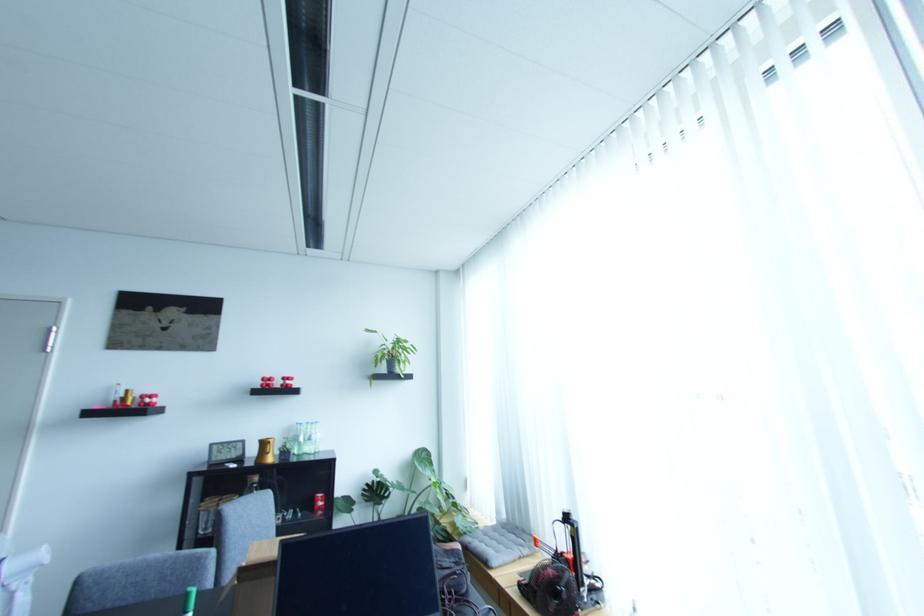
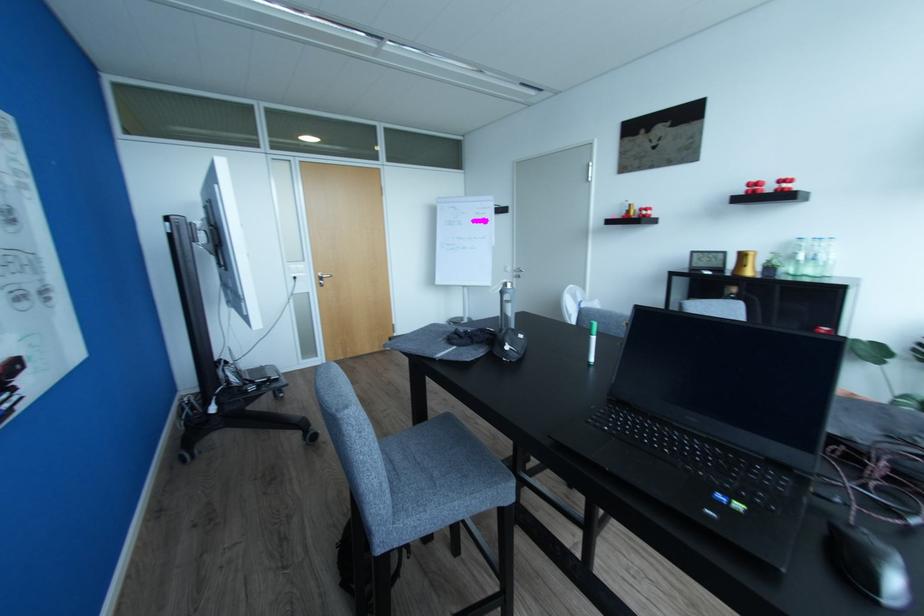
How did the camera likely rotate?

The camera's rotation is toward left-down.